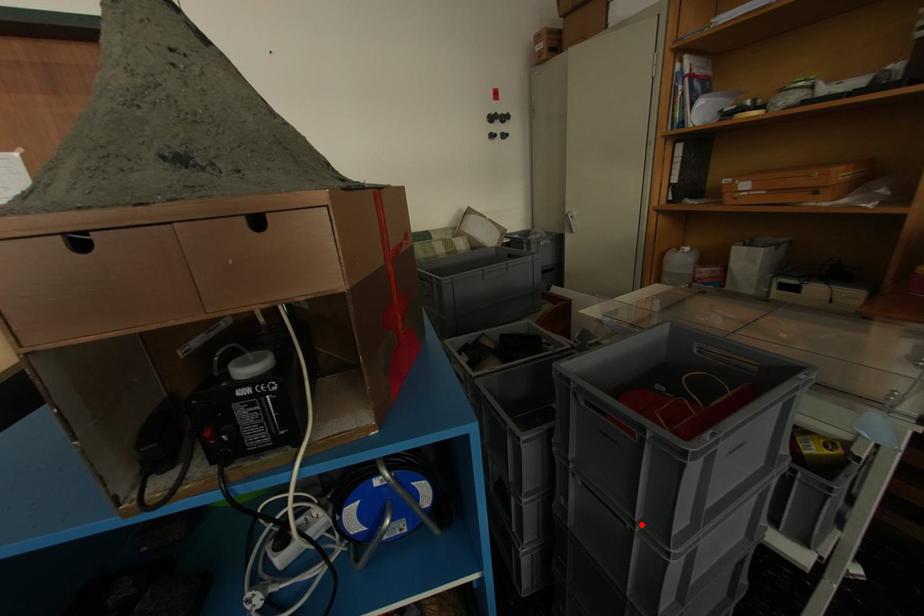
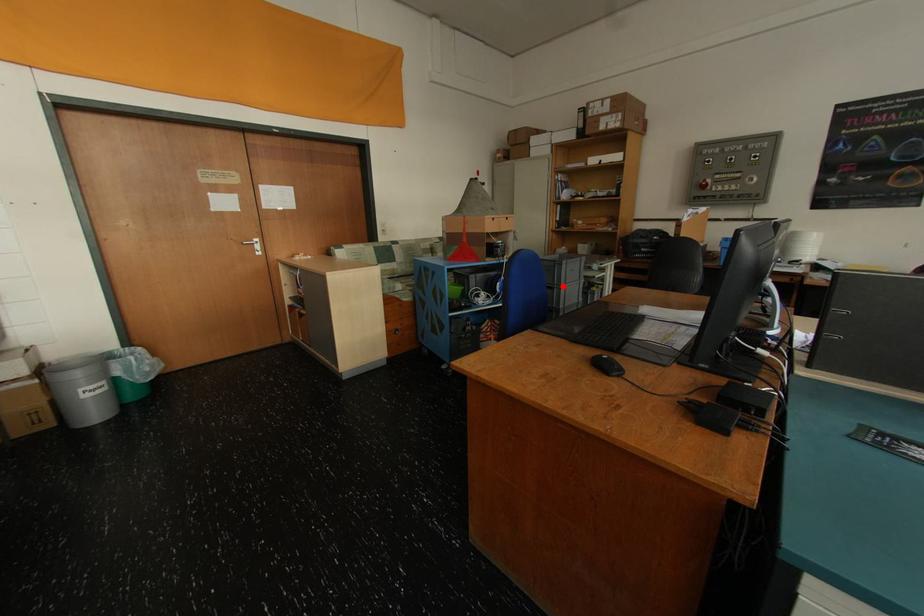
I am providing you with two images of the same scene from different viewpoints. A red point is marked on the first image and another point is marked on the second image. Is the marked point in image1 the same physical position as the marked point in image2?

Yes